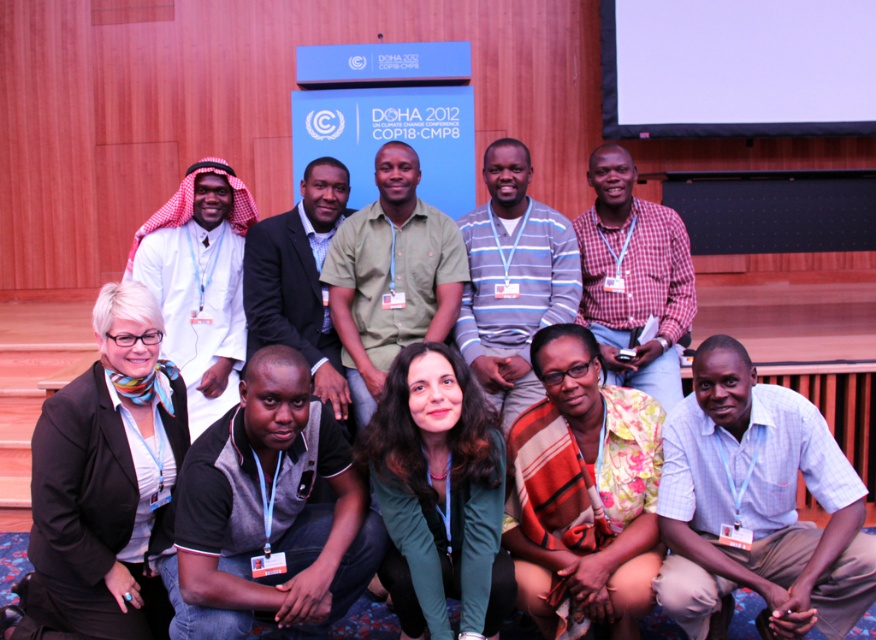
Between white cotton kufi at upper left and plaid shirt at center, which one is positioned lower?

white cotton kufi at upper left

Does white cotton kufi at upper left appear on the right side of plaid shirt at center?

Incorrect, white cotton kufi at upper left is not on the right side of plaid shirt at center.

Measure the distance between point [213,260] and camera.

A distance of 4.25 meters exists between point [213,260] and camera.

The width and height of the screenshot is (876, 640). In order to click on white cotton kufi at upper left in this screenshot , I will do click(x=199, y=284).

Does white shirt at lower right appear under dark green shirt at center?

Indeed, white shirt at lower right is positioned under dark green shirt at center.

Is point (774, 550) positioned before point (252, 326)?

That is True.

This screenshot has height=640, width=876. In order to click on white shirt at lower right in this screenshot , I will do `click(757, 506)`.

Between striped cotton shirt at center and white cotton kufi at upper left, which one has more height?

Standing taller between the two is striped cotton shirt at center.

Does point (525, 164) come behind point (230, 234)?

No.

Where is `striped cotton shirt at center`? The height and width of the screenshot is (640, 876). striped cotton shirt at center is located at coordinates (513, 280).